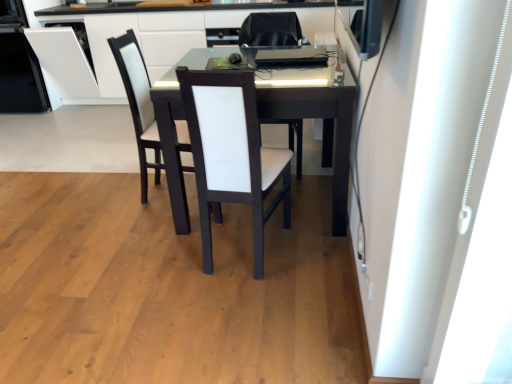
I want to click on vacant region to the left of white leather chair at center, so click(118, 191).